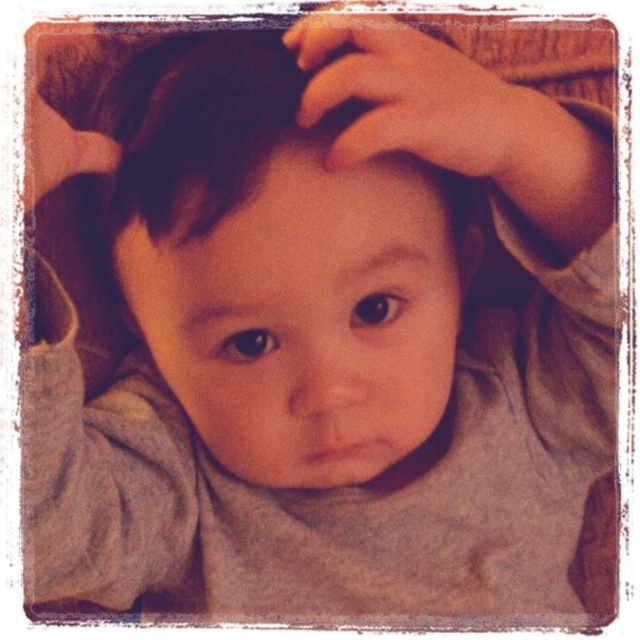
Based on the scene, which object is bigger between the dark brown silky hair at center and the smooth skin hand at upper center?

The dark brown silky hair at center is larger in size than the smooth skin hand at upper center according to the description.

You are a photographer adjusting the focus on your camera. You want to ensure both the dark brown silky hair at center and the smooth skin hand at upper center are in focus. Given that your camera can only maintain sharp focus within a 5 centimeter range, will both objects stay in focus simultaneously?

The dark brown silky hair at center and smooth skin hand at upper center are 8.44 centimeters apart, which exceeds the camera focus range of 5 centimeters. Therefore, both objects cannot be in focus at the same time.

You are a photographer analyzing the composition of this image. The child has dark brown silky hair at center and a smooth skin hand at upper center. Which object is located to the right of the other?

The smooth skin hand at upper center is to the right of the dark brown silky hair at center.